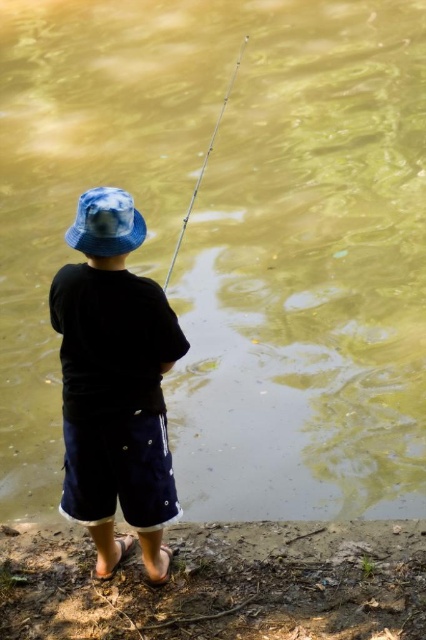
Is point (83, 292) in front of point (83, 250)?

No, it is behind (83, 250).

Is blue fabric bucket hat at center closer to camera compared to blue tie-dye bucket hat at upper center?

Yes, blue fabric bucket hat at center is in front of blue tie-dye bucket hat at upper center.

Image resolution: width=426 pixels, height=640 pixels. Identify the location of blue fabric bucket hat at center. (115, 384).

Does blue tie-dye bucket hat at upper center appear under silver metallic fishing pole at center?

Indeed, blue tie-dye bucket hat at upper center is positioned under silver metallic fishing pole at center.

Is point (134, 241) behind point (187, 209)?

No, it is in front of (187, 209).

The width and height of the screenshot is (426, 640). In order to click on blue tie-dye bucket hat at upper center in this screenshot , I will do `click(106, 224)`.

Between blue fabric bucket hat at center and silver metallic fishing pole at center, which one has more height?

With more height is silver metallic fishing pole at center.

Which is behind, point (141, 470) or point (190, 196)?

The point (190, 196) is behind.

Is point (89, 516) in front of point (175, 244)?

Yes.

Where is `blue fabric bucket hat at center`? blue fabric bucket hat at center is located at coordinates (115, 384).